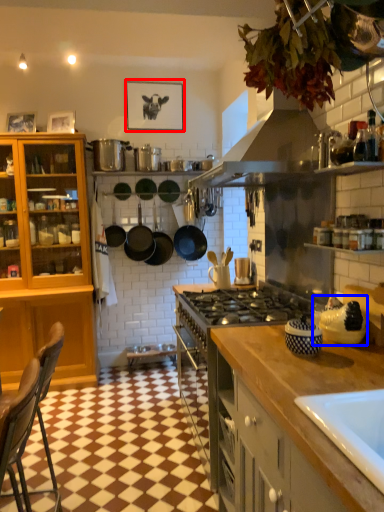
Question: Which point is closer to the camera, picture frame (highlighted by a red box) or appliance (highlighted by a blue box)?

Choices:
 (A) picture frame
 (B) appliance

Answer: (B)